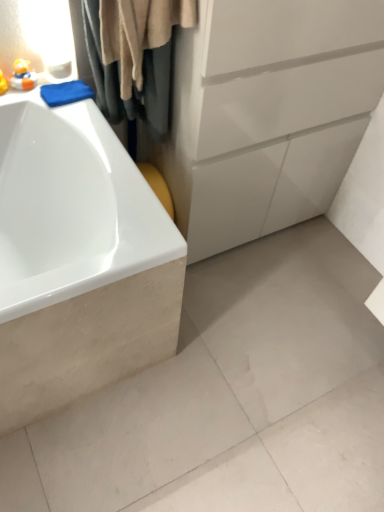
Question: Can you confirm if matte yellow rubber duck at upper left, positioned as the second toy in right-to-left order, is taller than white glossy bathtub at left?

Choices:
 (A) yes
 (B) no

Answer: (B)

Question: Considering the relative sizes of matte yellow rubber duck at upper left, positioned as the second toy in right-to-left order, and white glossy bathtub at left in the image provided, is matte yellow rubber duck at upper left, positioned as the second toy in right-to-left order, smaller than white glossy bathtub at left?

Choices:
 (A) yes
 (B) no

Answer: (A)

Question: Is matte yellow rubber duck at upper left, the first toy positioned from the left, turned away from white glossy bathtub at left?

Choices:
 (A) no
 (B) yes

Answer: (A)

Question: From a real-world perspective, is matte yellow rubber duck at upper left, the first toy positioned from the left, physically above white glossy bathtub at left?

Choices:
 (A) yes
 (B) no

Answer: (A)

Question: Does matte yellow rubber duck at upper left, the first toy positioned from the left, have a greater width compared to white glossy bathtub at left?

Choices:
 (A) yes
 (B) no

Answer: (B)

Question: Does matte yellow rubber duck at upper left, the first toy positioned from the left, appear on the left side of white glossy bathtub at left?

Choices:
 (A) no
 (B) yes

Answer: (B)

Question: Is white matte concrete at lower left completely or partially outside of white glossy bathtub at left?

Choices:
 (A) no
 (B) yes

Answer: (B)

Question: Can you confirm if white matte concrete at lower left is positioned to the right of white glossy bathtub at left?

Choices:
 (A) no
 (B) yes

Answer: (B)

Question: From the image's perspective, is white matte concrete at lower left on white glossy bathtub at left?

Choices:
 (A) no
 (B) yes

Answer: (A)

Question: Is white glossy bathtub at left at the back of white matte concrete at lower left?

Choices:
 (A) no
 (B) yes

Answer: (B)

Question: Is white matte concrete at lower left smaller than white glossy bathtub at left?

Choices:
 (A) no
 (B) yes

Answer: (B)

Question: Is white matte concrete at lower left thinner than white glossy bathtub at left?

Choices:
 (A) no
 (B) yes

Answer: (A)

Question: Is white glossy bathtub at left shorter than matte yellow rubber duck at upper left, positioned as the second toy in right-to-left order?

Choices:
 (A) yes
 (B) no

Answer: (B)